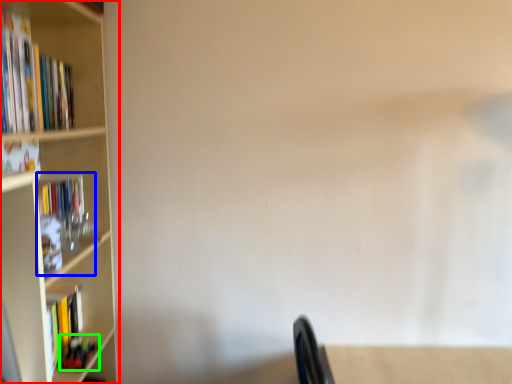
Question: Which object is positioned closest to bookcase (highlighted by a red box)? Select from book (highlighted by a blue box) and book (highlighted by a green box).

Choices:
 (A) book
 (B) book

Answer: (A)